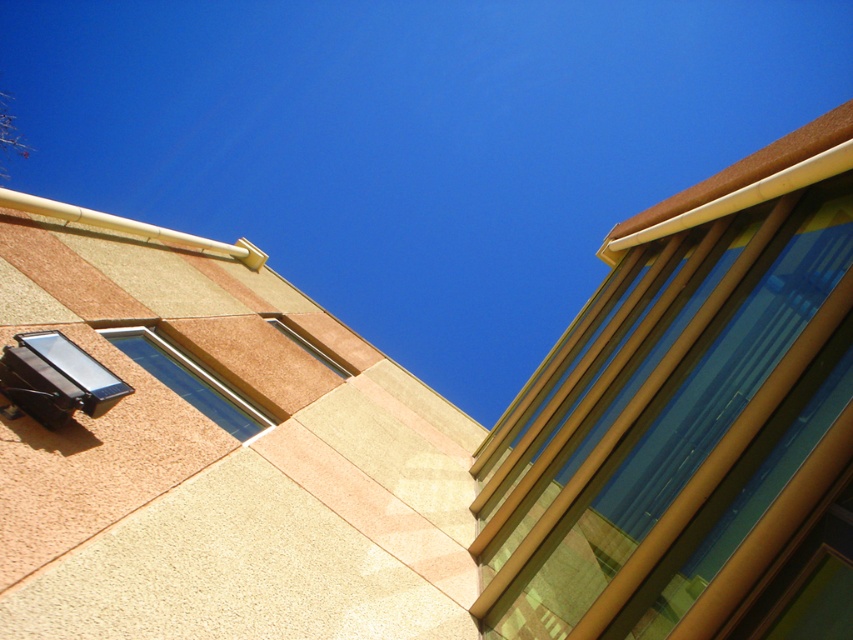
Question: Which object appears closest to the camera in this image?

Choices:
 (A) matte gold window at upper right
 (B) black plastic window at lower left
 (C) clear glass window at upper left
 (D) metallic silver window at upper center

Answer: (B)

Question: Considering the relative positions of clear glass window at upper left and metallic silver window at upper center in the image provided, where is clear glass window at upper left located with respect to metallic silver window at upper center?

Choices:
 (A) below
 (B) above

Answer: (A)

Question: Can you confirm if black plastic window at lower left is thinner than metallic silver window at upper center?

Choices:
 (A) no
 (B) yes

Answer: (B)

Question: Is black plastic window at lower left thinner than metallic silver window at upper center?

Choices:
 (A) yes
 (B) no

Answer: (A)

Question: Which object is the closest to the matte gold window at upper right?

Choices:
 (A) clear glass window at upper left
 (B) metallic silver window at upper center
 (C) black plastic window at lower left

Answer: (C)

Question: Considering the real-world distances, which object is farthest from the black plastic window at lower left?

Choices:
 (A) clear glass window at upper left
 (B) matte gold window at upper right
 (C) metallic silver window at upper center

Answer: (C)